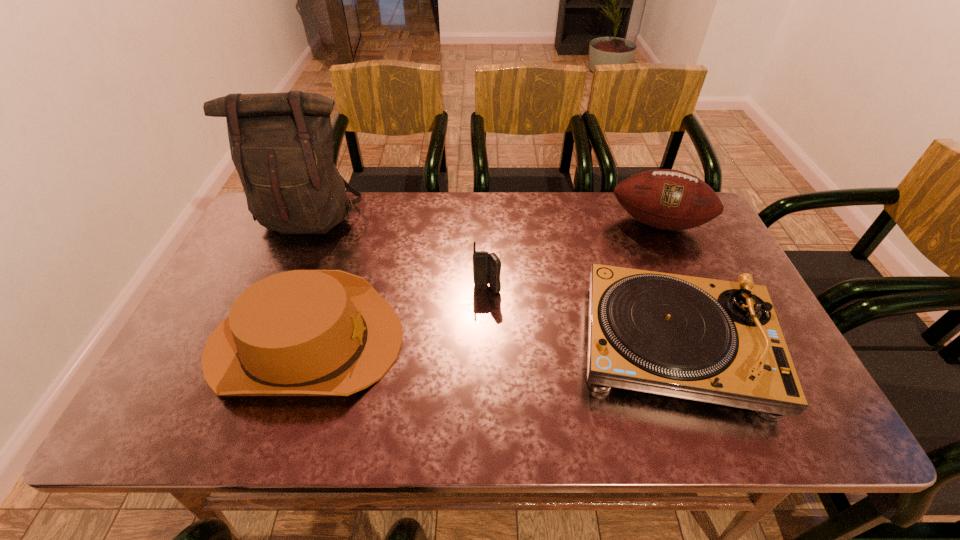
Locate an element on the screen. This screenshot has width=960, height=540. empty location between the tallest object and the cellular telephone is located at coordinates [398, 254].

Point out which object is positioned as the second nearest to the record player. Please provide its 2D coordinates. Your answer should be formatted as a tuple, i.e. [(x, y)], where the tuple contains the x and y coordinates of a point satisfying the conditions above.

[(486, 267)]

Select which object is the fourth closest to the second tallest object. Please provide its 2D coordinates. Your answer should be formatted as a tuple, i.e. [(x, y)], where the tuple contains the x and y coordinates of a point satisfying the conditions above.

[(281, 144)]

Identify the location of free space that satisfies the following two spatial constraints: 1. on the keyboard of the cellular telephone; 2. on the front-facing side of the cowboy hat. pyautogui.click(x=488, y=342).

This screenshot has width=960, height=540. In order to click on vacant space that satisfies the following two spatial constraints: 1. on the back side of the record player; 2. on the front-facing side of the cowboy hat in this screenshot , I will do `click(673, 342)`.

This screenshot has width=960, height=540. Find the location of `free space that satisfies the following two spatial constraints: 1. on the back side of the record player; 2. on the right side of the second tallest object`. free space that satisfies the following two spatial constraints: 1. on the back side of the record player; 2. on the right side of the second tallest object is located at coordinates (629, 223).

Where is `free space that satisfies the following two spatial constraints: 1. on the keyboard of the third object from left to right; 2. on the front-facing side of the cowboy hat`? This screenshot has width=960, height=540. free space that satisfies the following two spatial constraints: 1. on the keyboard of the third object from left to right; 2. on the front-facing side of the cowboy hat is located at coordinates (488, 342).

At what (x,y) coordinates should I click in order to perform the action: click on free spot that satisfies the following two spatial constraints: 1. on the open flap of the football (American); 2. on the left side of the backpack. Please return your answer as a coordinate pair (x, y). This screenshot has width=960, height=540. Looking at the image, I should click on (307, 223).

The height and width of the screenshot is (540, 960). I want to click on vacant position in the image that satisfies the following two spatial constraints: 1. on the back side of the football (American); 2. on the left side of the record player, so pos(629,223).

At what (x,y) coordinates should I click in order to perform the action: click on vacant space that satisfies the following two spatial constraints: 1. on the keyboard of the record player; 2. on the right side of the third object from left to right. Please return your answer as a coordinate pair (x, y). Looking at the image, I should click on (488, 346).